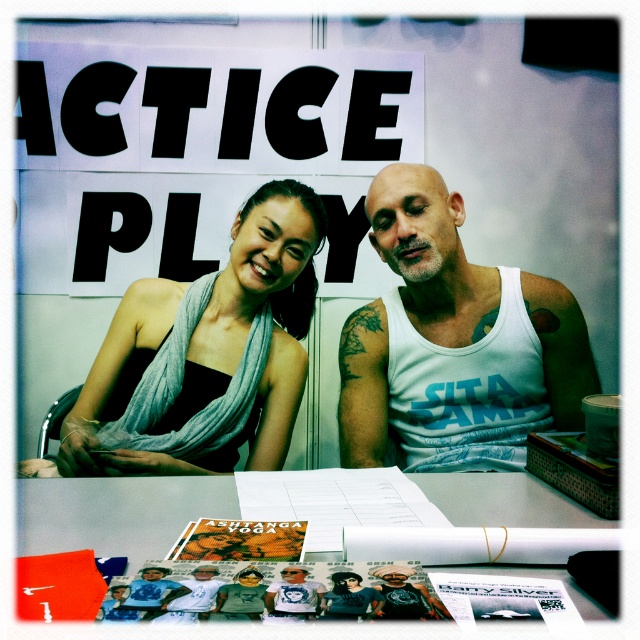
You are a fashion designer observing two tank tops on a table in the image. The items are the matte white tank top at center and the white cotton tank top at center. Which tank top has a longer length?

The white cotton tank top at center is longer than the matte white tank top at center.

You are a photographer setting up for a photoshoot. You need to place a small prop between the two people so that it is visible in the frame. Given the white cotton tank top at center and the white paper at center, which object should you place the prop closer to to ensure it doesn

The white cotton tank top at center is taller than the white paper at center. To ensure the prop is visible in the frame, place it closer to the white cotton tank top at center since it has a greater height and will provide a better backdrop for visibility.